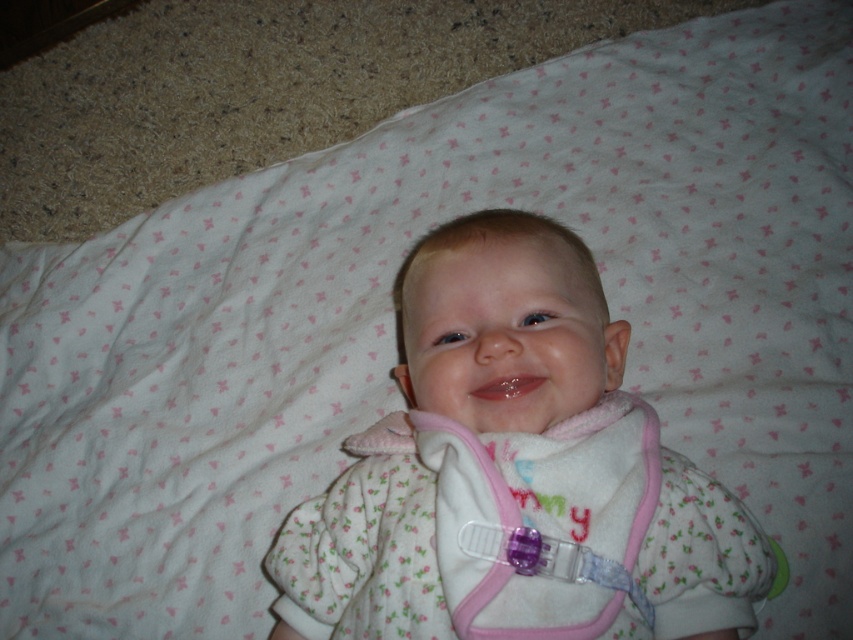
Question: Which point is closer to the camera?

Choices:
 (A) (489, 472)
 (B) (339, 624)

Answer: (A)

Question: Can you confirm if white fleece baby at center is positioned below pink fleece bib at center?

Choices:
 (A) no
 (B) yes

Answer: (A)

Question: Is white fleece baby at center to the left of pink fleece bib at center from the viewer's perspective?

Choices:
 (A) yes
 (B) no

Answer: (A)

Question: Is white fleece baby at center wider than pink fleece bib at center?

Choices:
 (A) no
 (B) yes

Answer: (B)

Question: Which object appears closest to the camera in this image?

Choices:
 (A) white fleece baby at center
 (B) pink fleece bib at center

Answer: (B)